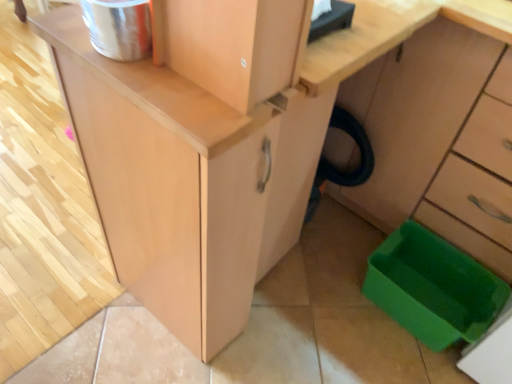
Locate an element on the screen. green plastic trash can at lower right is located at coordinates (442, 131).

The width and height of the screenshot is (512, 384). What do you see at coordinates (442, 131) in the screenshot? I see `green plastic trash can at lower right` at bounding box center [442, 131].

Find the location of a particular element. The width and height of the screenshot is (512, 384). green plastic storage box at lower right is located at coordinates (432, 287).

What do you see at coordinates (432, 287) in the screenshot?
I see `green plastic storage box at lower right` at bounding box center [432, 287].

At what (x,y) coordinates should I click in order to perform the action: click on green plastic trash can at lower right. Please return your answer as a coordinate pair (x, y). Looking at the image, I should click on [x=442, y=131].

Is green plastic trash can at lower right to the right of green plastic storage box at lower right from the viewer's perspective?

Yes, green plastic trash can at lower right is to the right of green plastic storage box at lower right.

Does green plastic trash can at lower right come behind green plastic storage box at lower right?

No, it is in front of green plastic storage box at lower right.

Is point (398, 122) closer to camera compared to point (436, 319)?

No.

From the image's perspective, which object appears higher, green plastic trash can at lower right or green plastic storage box at lower right?

green plastic trash can at lower right, from the image's perspective.

From a real-world perspective, which object stands above the other?

green plastic trash can at lower right, from a real-world perspective.

Looking at their sizes, would you say green plastic trash can at lower right is wider or thinner than green plastic storage box at lower right?

Considering their sizes, green plastic trash can at lower right looks broader than green plastic storage box at lower right.

Can you confirm if green plastic trash can at lower right is taller than green plastic storage box at lower right?

Yes.

Is green plastic trash can at lower right bigger than green plastic storage box at lower right?

Yes, green plastic trash can at lower right is bigger than green plastic storage box at lower right.

Is green plastic trash can at lower right not within green plastic storage box at lower right?

Yes, green plastic trash can at lower right is not within green plastic storage box at lower right.

Is green plastic trash can at lower right not close to green plastic storage box at lower right?

No, there isn't a large distance between green plastic trash can at lower right and green plastic storage box at lower right.

Is green plastic trash can at lower right facing towards green plastic storage box at lower right?

Yes, green plastic trash can at lower right is turned towards green plastic storage box at lower right.

Where is `storage box that appears behind the green plastic trash can at lower right`? storage box that appears behind the green plastic trash can at lower right is located at coordinates (432, 287).

From the picture: Considering the relative positions of green plastic storage box at lower right and green plastic trash can at lower right in the image provided, is green plastic storage box at lower right to the right of green plastic trash can at lower right from the viewer's perspective?

Incorrect, green plastic storage box at lower right is not on the right side of green plastic trash can at lower right.

Relative to green plastic trash can at lower right, is green plastic storage box at lower right in front or behind?

green plastic storage box at lower right is behind green plastic trash can at lower right.

Which is farther from the camera, (403,258) or (408,179)?

The point (403,258) is farther.

From the picture: From the image's perspective, which is below, green plastic storage box at lower right or green plastic trash can at lower right?

green plastic storage box at lower right appears lower in the image.

From a real-world perspective, who is located higher, green plastic storage box at lower right or green plastic trash can at lower right?

green plastic trash can at lower right is physically above.

Consider the image. Does green plastic storage box at lower right have a lesser width compared to green plastic trash can at lower right?

Yes.

Is green plastic storage box at lower right shorter than green plastic trash can at lower right?

Correct, green plastic storage box at lower right is not as tall as green plastic trash can at lower right.

Looking at this image, between green plastic storage box at lower right and green plastic trash can at lower right, which one has larger size?

Bigger between the two is green plastic trash can at lower right.

Which is correct: green plastic storage box at lower right is inside green plastic trash can at lower right, or outside of it?

green plastic storage box at lower right is located beyond the bounds of green plastic trash can at lower right.

Is green plastic storage box at lower right positioned far away from green plastic trash can at lower right?

Actually, green plastic storage box at lower right and green plastic trash can at lower right are a little close together.

Is green plastic storage box at lower right positioned with its back to green plastic trash can at lower right?

Correct, green plastic storage box at lower right is looking away from green plastic trash can at lower right.

The image size is (512, 384). I want to click on cabinetry above the green plastic storage box at lower right (from a real-world perspective), so click(442, 131).

I want to click on storage box behind the green plastic trash can at lower right, so click(x=432, y=287).

The height and width of the screenshot is (384, 512). In order to click on storage box on the left of green plastic trash can at lower right in this screenshot , I will do click(432, 287).